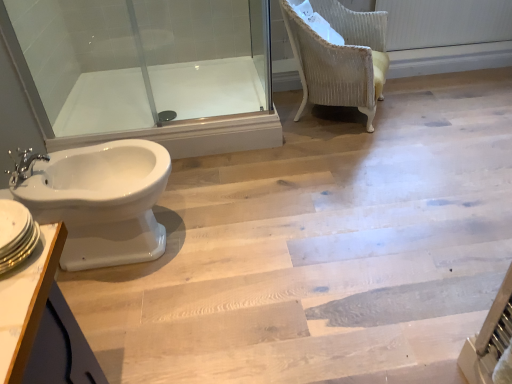
Question: Do you think white glossy bathtub at upper left is within velvet yellow chair at upper right, or outside of it?

Choices:
 (A) inside
 (B) outside

Answer: (B)

Question: In terms of height, does white glossy bathtub at upper left look taller or shorter compared to velvet yellow chair at upper right?

Choices:
 (A) tall
 (B) short

Answer: (B)

Question: Considering the real-world distances, which object is closest to the white glossy bathtub at upper left?

Choices:
 (A) chrome metallic faucet at left
 (B) white glossy bidet at left
 (C) white glossy sink at lower left
 (D) white glossy bidet at lower left
 (E) velvet yellow chair at upper right

Answer: (E)

Question: Estimate the real-world distances between objects in this image. Which object is closer to the white glossy bidet at left?

Choices:
 (A) chrome metallic faucet at left
 (B) white glossy bathtub at upper left
 (C) velvet yellow chair at upper right
 (D) white glossy sink at lower left
 (E) white glossy bidet at lower left

Answer: (E)